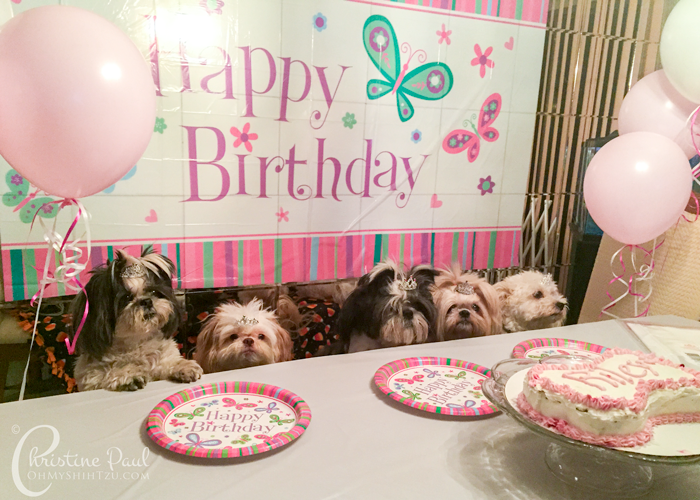
Where is `tiny, narrow pink, green, and purple vertical stripes on rims of white plates`? Image resolution: width=700 pixels, height=500 pixels. tiny, narrow pink, green, and purple vertical stripes on rims of white plates is located at coordinates (267, 450), (285, 398), (150, 414), (386, 366), (425, 406), (538, 344).